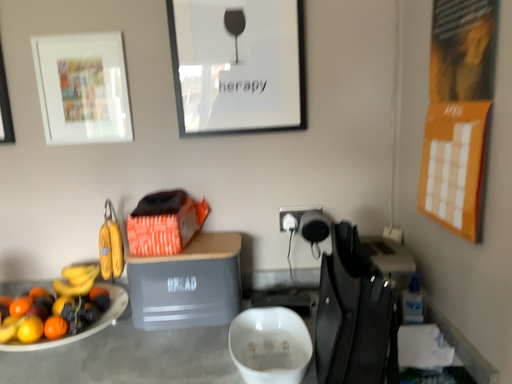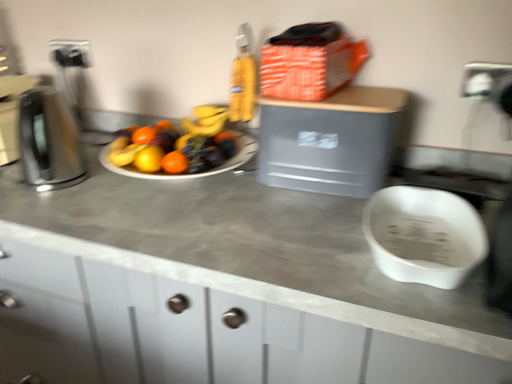
Question: How did the camera likely rotate when shooting the video?

Choices:
 (A) rotated right
 (B) rotated left

Answer: (B)